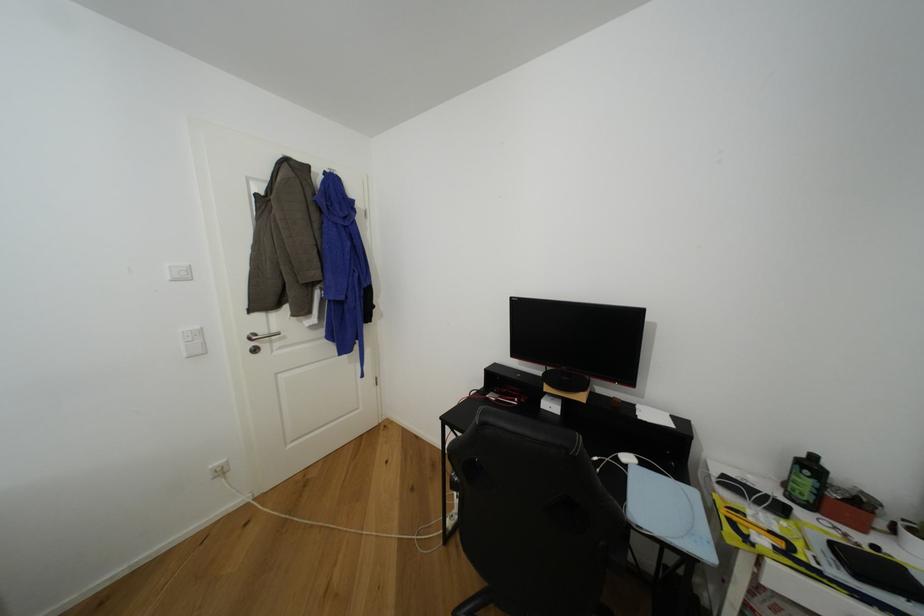
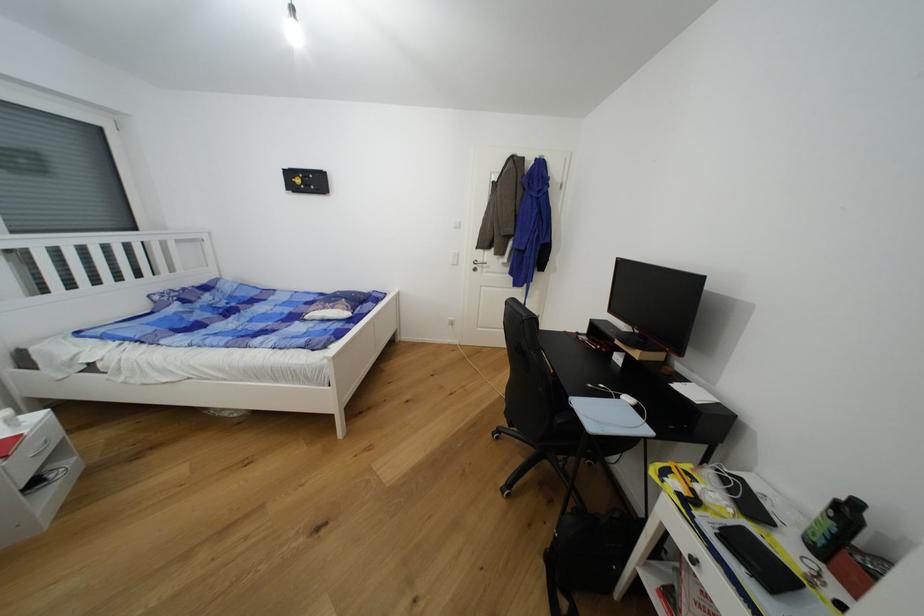
The point at [268,334] is marked in the first image. Where is the corresponding point in the second image?

(484, 262)